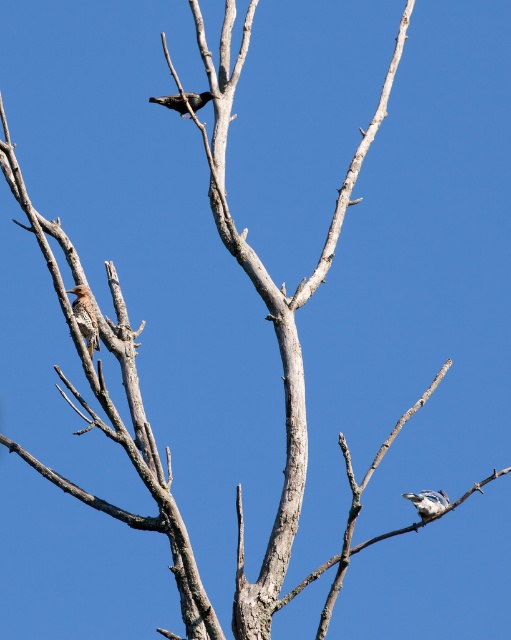
You are standing in front of the tree and want to observe the two points marked on the branches. Which point, point (x=89, y=332) or point (x=446, y=502), is closer to you?

Point (x=89, y=332) is closer to the camera than point (x=446, y=502).

You are a birdwatcher observing the tree. You notice two birds on the tree. Which bird is positioned higher up on the tree, the blue glossy bird at lower right or the shiny black bird at upper center?

The shiny black bird at upper center is positioned higher up on the tree than the blue glossy bird at lower right.